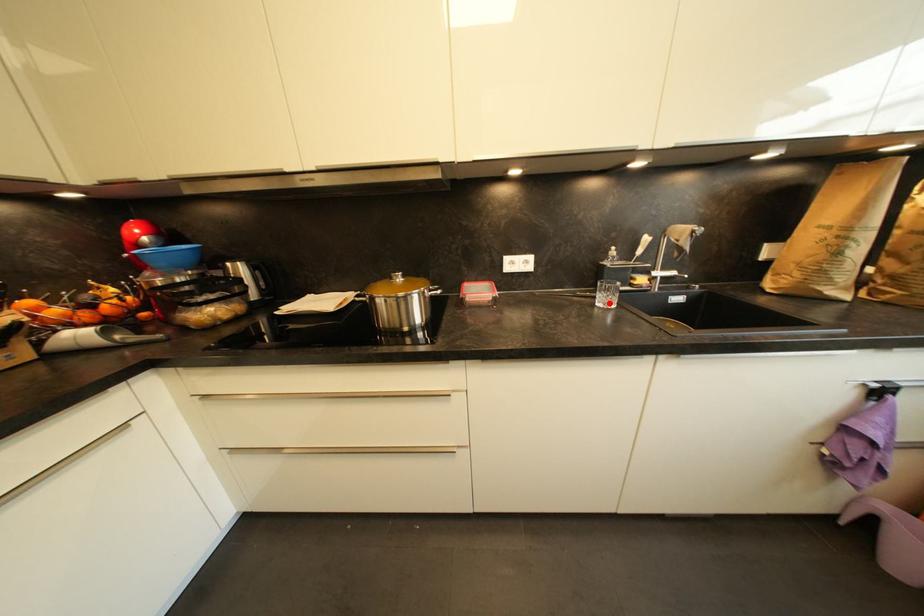
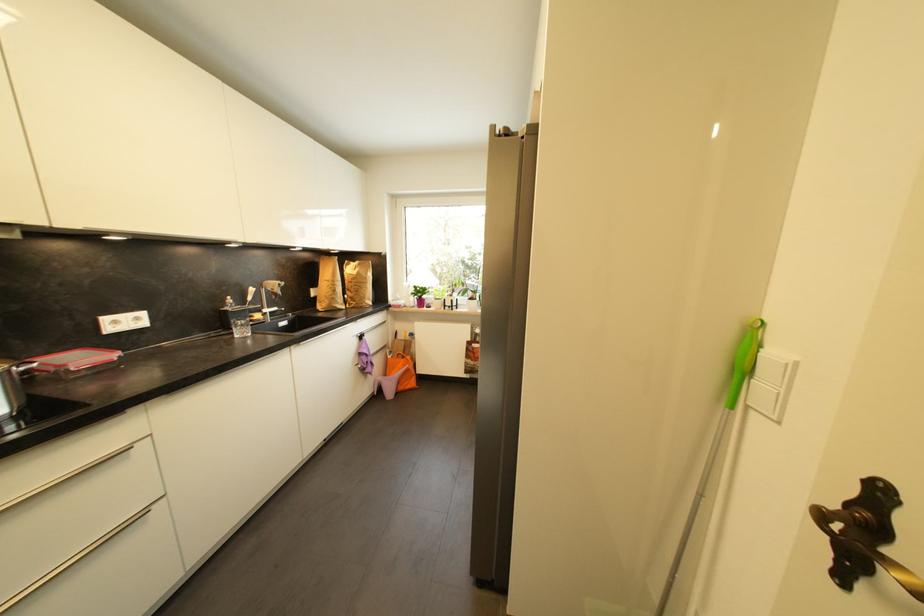
The point at the highlighted location is marked in the first image. Where is the corresponding point in the second image?

(247, 334)